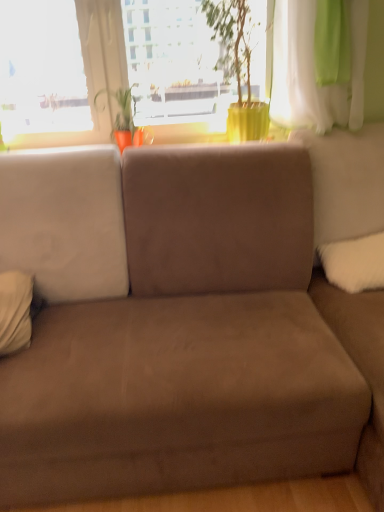
Question: Is green matte plant pot at upper center wider or thinner than white soft pillow at left, which is counted as the second pillow, starting from the right?

Choices:
 (A) wide
 (B) thin

Answer: (A)

Question: Visually, is green matte plant pot at upper center positioned to the left or to the right of white soft pillow at left, which is counted as the second pillow, starting from the right?

Choices:
 (A) left
 (B) right

Answer: (B)

Question: Which object is positioned closest to the transparent glass window at upper center?

Choices:
 (A) green sheer curtain at upper right
 (B) white fluffy pillow at right, acting as the 2th pillow starting from the left
 (C) white soft pillow at left, which is counted as the second pillow, starting from the right
 (D) matte orange pot at center
 (E) green matte plant pot at upper center

Answer: (D)

Question: Which object is positioned farthest from the transparent glass window at upper center?

Choices:
 (A) white fluffy pillow at right, the first pillow positioned from the right
 (B) green matte plant pot at upper center
 (C) matte orange pot at center
 (D) white soft pillow at left, which is counted as the second pillow, starting from the right
 (E) green sheer curtain at upper right

Answer: (A)